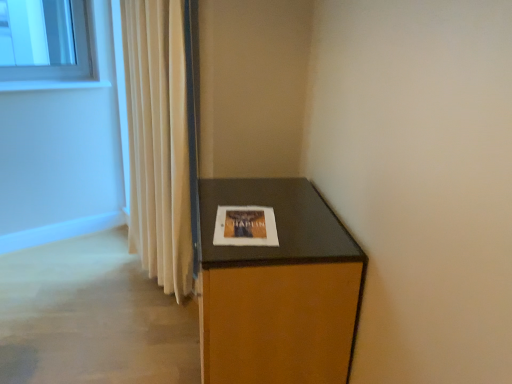
Locate an element on the screen. The image size is (512, 384). free space that is to the left of beige fabric curtain at left is located at coordinates 113,292.